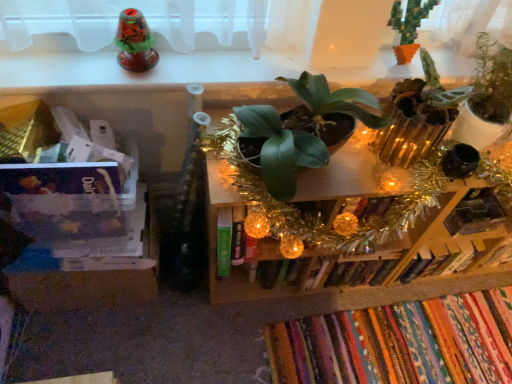
At what (x,y) coordinates should I click in order to perform the action: click on vacant area in front of hardcover book at center-right, which ranks as the 2th book in bottom-to-top order. Please return your answer as a coordinate pair (x, y). The height and width of the screenshot is (384, 512). Looking at the image, I should click on (425, 307).